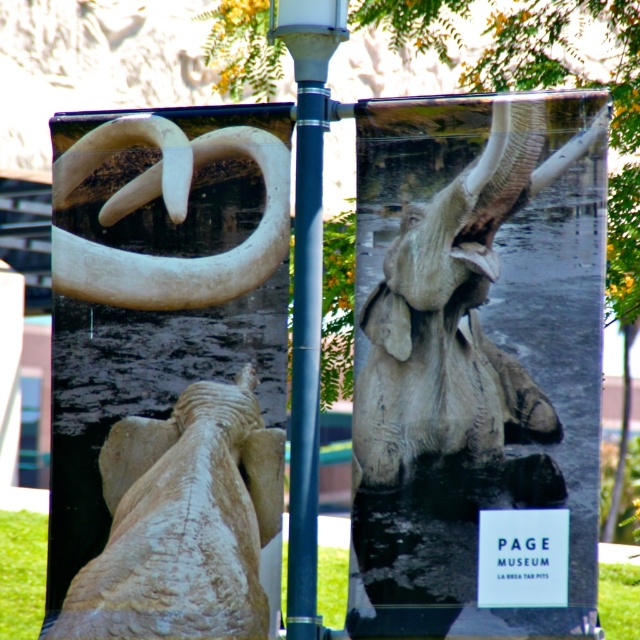
Question: Is matte gray elephant at center closer to camera compared to metallic gray pole at center?

Choices:
 (A) yes
 (B) no

Answer: (A)

Question: Can you confirm if matte gray elephant at center is positioned to the right of metallic gray pole at center?

Choices:
 (A) yes
 (B) no

Answer: (A)

Question: Among these objects, which one is farthest from the camera?

Choices:
 (A) rough stone elephant at center
 (B) metallic gray pole at center
 (C) matte gray elephant at center

Answer: (A)

Question: Does matte gray elephant at center appear under metallic gray pole at center?

Choices:
 (A) no
 (B) yes

Answer: (B)

Question: Which of the following is the closest to the observer?

Choices:
 (A) metallic gray pole at center
 (B) rough stone elephant at center
 (C) matte gray elephant at center

Answer: (C)

Question: Which object appears closest to the camera in this image?

Choices:
 (A) metallic gray pole at center
 (B) matte gray elephant at center

Answer: (B)